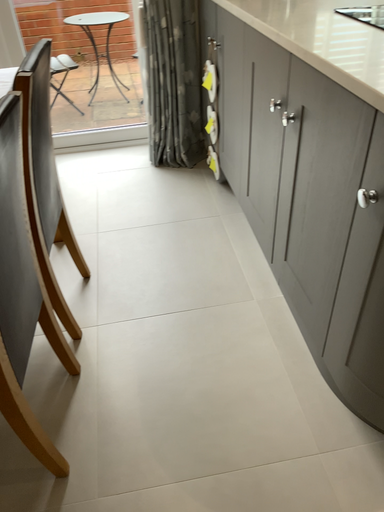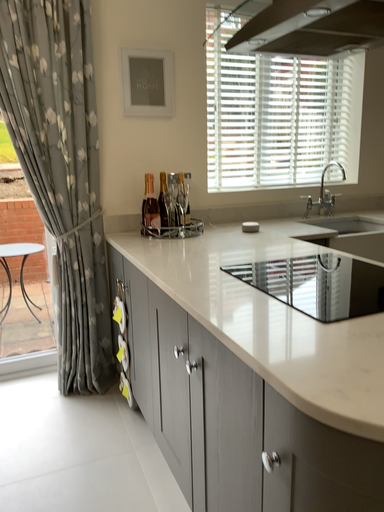
Question: Which way did the camera rotate in the video?

Choices:
 (A) rotated downward
 (B) rotated upward

Answer: (B)